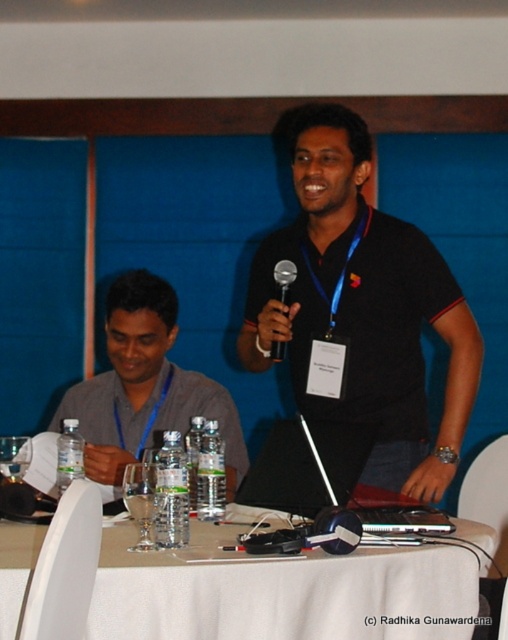
Which is more to the right, white cloth table at center or gray fabric shirt at left?

white cloth table at center is more to the right.

Does white cloth table at center appear on the right side of gray fabric shirt at left?

Correct, you'll find white cloth table at center to the right of gray fabric shirt at left.

Describe the element at coordinates (283, 595) in the screenshot. I see `white cloth table at center` at that location.

The height and width of the screenshot is (640, 508). Identify the location of white cloth table at center. (283, 595).

Is black matte shirt at center to the left of gray fabric shirt at left from the viewer's perspective?

In fact, black matte shirt at center is to the right of gray fabric shirt at left.

Looking at this image, is black matte shirt at center behind gray fabric shirt at left?

That is False.

Is point (360, 205) farther from camera compared to point (103, 429)?

That is False.

Locate an element on the screen. This screenshot has height=640, width=508. black matte shirt at center is located at coordinates (364, 308).

Does white cloth table at center appear under silver metallic microphone at center?

Correct, white cloth table at center is located below silver metallic microphone at center.

The height and width of the screenshot is (640, 508). I want to click on white cloth table at center, so click(x=283, y=595).

Is point (183, 570) farther from camera compared to point (282, 355)?

No, it is not.

I want to click on white cloth table at center, so coord(283,595).